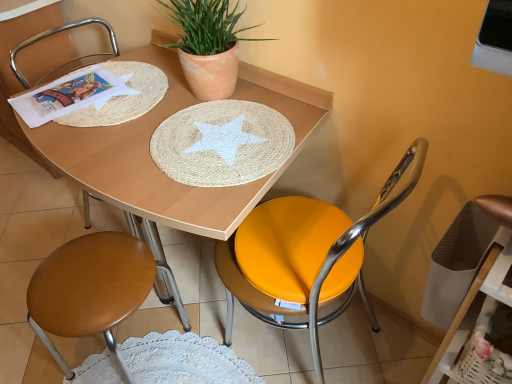
Where is `blank space situated above brown leather stool at lower left, positioned as the second chair in left-to-right order (from a real-world perspective)`? blank space situated above brown leather stool at lower left, positioned as the second chair in left-to-right order (from a real-world perspective) is located at coordinates (92, 278).